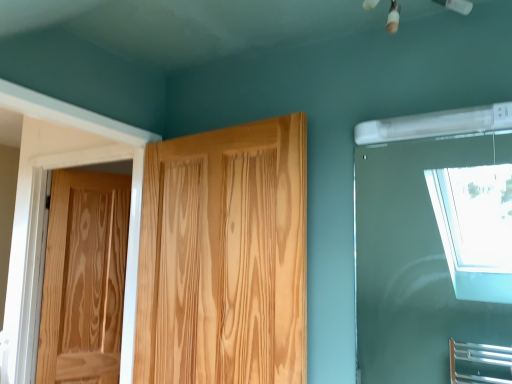
Question: Is natural wood door at center, the first door viewed from the right, inside the boundaries of natural wood door at left, the second door positioned from the right, or outside?

Choices:
 (A) inside
 (B) outside

Answer: (B)

Question: Relative to natural wood door at left, placed as the first door when sorted from back to front, is natural wood door at center, arranged as the second door when viewed from the back, in front or behind?

Choices:
 (A) behind
 (B) front

Answer: (B)

Question: Estimate the real-world distances between objects in this image. Which object is farther from the transparent glass window at upper right?

Choices:
 (A) natural wood door at center, arranged as the second door when viewed from the back
 (B) natural wood door at left, placed as the first door when sorted from back to front

Answer: (B)

Question: Estimate the real-world distances between objects in this image. Which object is farther from the transparent glass window at upper right?

Choices:
 (A) natural wood door at left, the second door positioned from the right
 (B) natural wood door at center, the second door viewed from the left

Answer: (A)